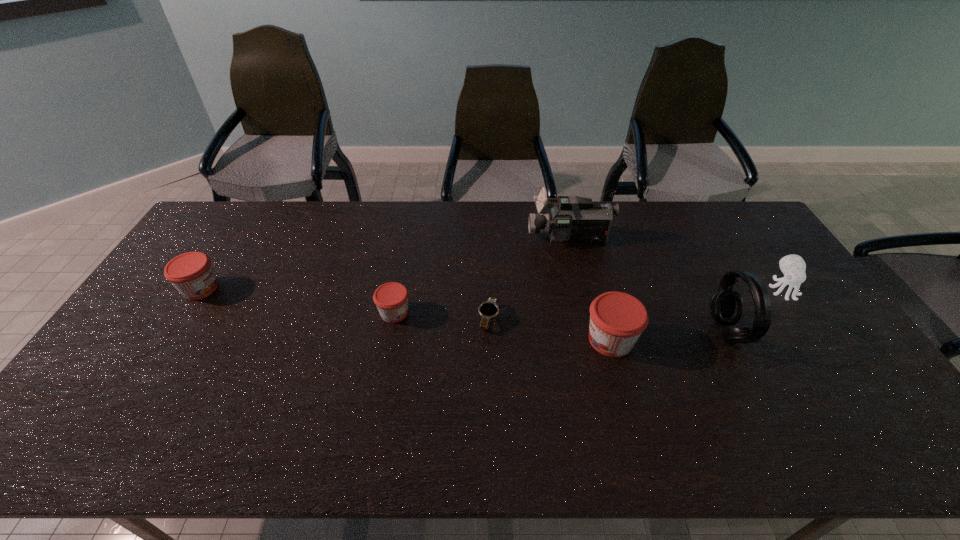
Where is `the second shortest jam`? the second shortest jam is located at coordinates (191, 273).

Locate an element on the screen. This screenshot has width=960, height=540. the leftmost object is located at coordinates (191, 273).

Image resolution: width=960 pixels, height=540 pixels. I want to click on the sixth object from right to left, so click(x=391, y=299).

I want to click on the shortest jam, so click(391, 299).

Locate an element on the screen. Image resolution: width=960 pixels, height=540 pixels. the rightmost jam is located at coordinates (617, 319).

Locate an element on the screen. This screenshot has height=540, width=960. headset is located at coordinates (726, 305).

Identify the location of octopus. This screenshot has height=540, width=960. (793, 267).

Locate an element on the screen. The height and width of the screenshot is (540, 960). the farthest object is located at coordinates (573, 219).

At what (x,y) coordinates should I click in order to perform the action: click on watch. Please return your answer as a coordinate pair (x, y). Looking at the image, I should click on (487, 310).

Where is `the third object from left to right`? The image size is (960, 540). the third object from left to right is located at coordinates (487, 310).